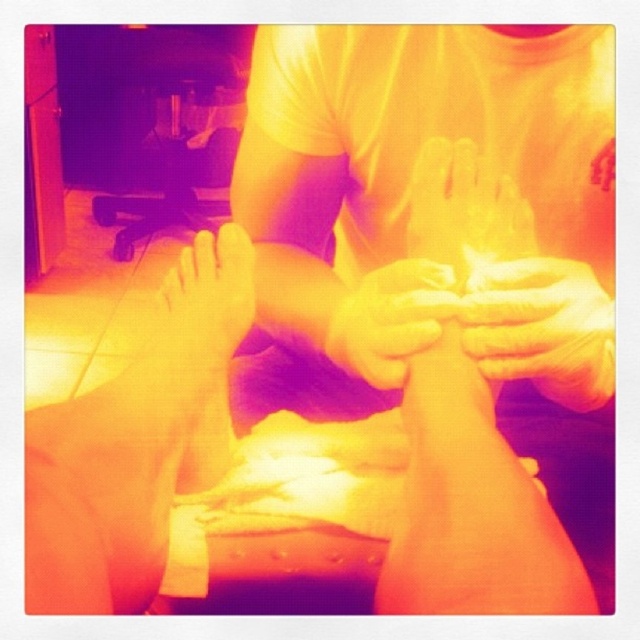
You are a photographer trying to capture a closeup of the white rubber glove at center for a spa advertisement. The camera you are using has a minimum focusing distance of 16 inches. Based on the scene, will you be able to take the photo without moving closer?

The white rubber glove at center is 18.66 inches from the camera, which is beyond the minimum focusing distance of 16 inches. Therefore, you can take the photo without moving closer.

You are a spa customer who wants to know if the white rubber glove at center is covering the smooth white hands at center. Based on the scene, can you tell me if the glove is taller than the hands?

The white rubber glove at center is much taller than smooth white hands at center, so yes, the glove is taller than the hands.

You are a therapist in a spa who needs to ensure proper hygiene. You have a white rubber glove at center and a smooth white hand at center. Are the two items close enough to accidentally touch each other?

The white rubber glove at center is 2.16 inches away from the smooth white hand at center, so they are close enough to accidentally touch each other if not careful.